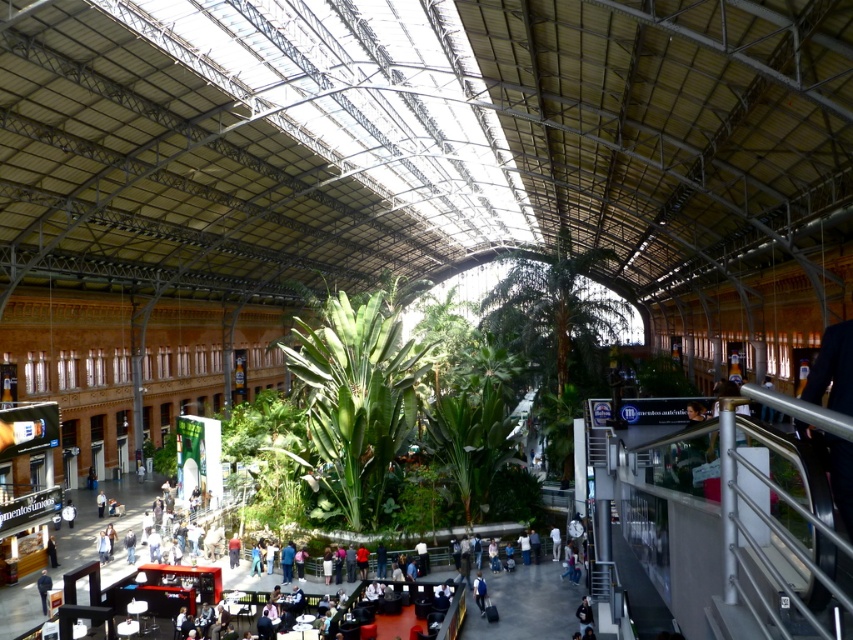
Question: Is blue fabric jacket at center below white fabric jacket at center?

Choices:
 (A) no
 (B) yes

Answer: (B)

Question: Which point is farther to the camera?

Choices:
 (A) (41, 580)
 (B) (560, 541)
 (C) (579, 627)
 (D) (476, 573)

Answer: (B)

Question: Is the position of blue fabric jacket at center more distant than that of dark blue jacket at center?

Choices:
 (A) no
 (B) yes

Answer: (A)

Question: Based on their relative distances, which object is nearer to the white fabric jacket at center?

Choices:
 (A) dark gray jacket at center
 (B) blue fabric jacket at center
 (C) dark blue jacket at center

Answer: (B)

Question: Based on their relative distances, which object is farther from the white fabric jacket at center?

Choices:
 (A) dark gray jacket at center
 (B) dark blue jacket at center
 (C) blue fabric jacket at center

Answer: (B)

Question: Does dark gray jacket at center have a larger size compared to dark blue jacket at center?

Choices:
 (A) no
 (B) yes

Answer: (A)